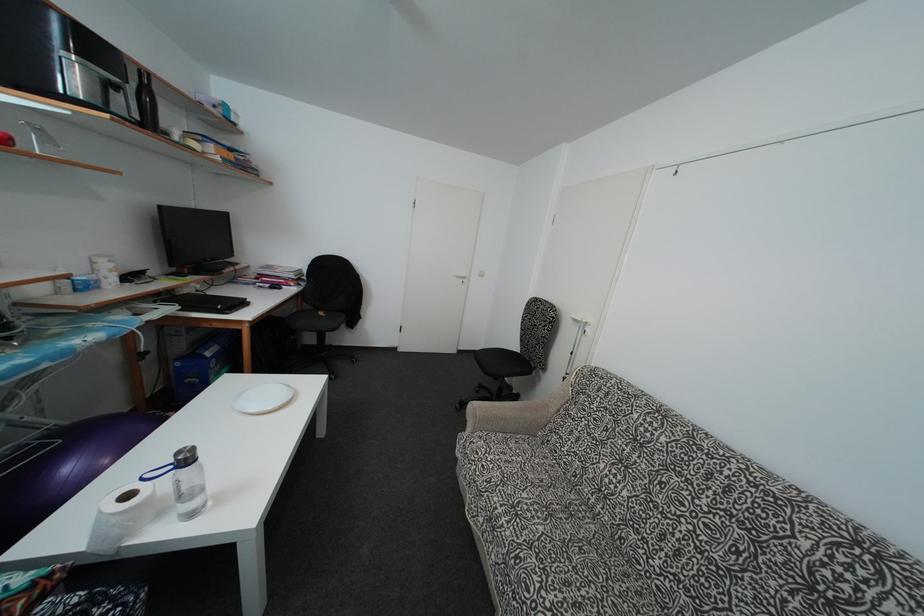
Where would you pull the white door handle? Please return your answer as a coordinate pair (x, y).

(462, 280)